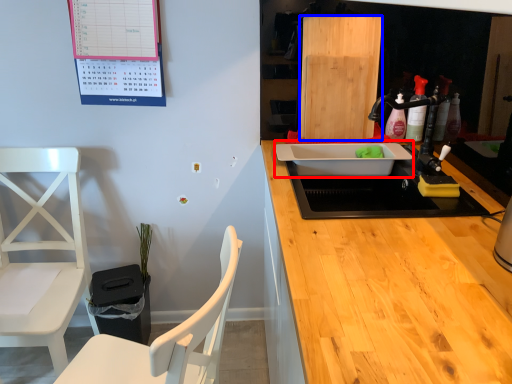
Question: Which of the following is the farthest to the observer, sink (highlighted by a red box) or plywood (highlighted by a blue box)?

Choices:
 (A) sink
 (B) plywood

Answer: (B)